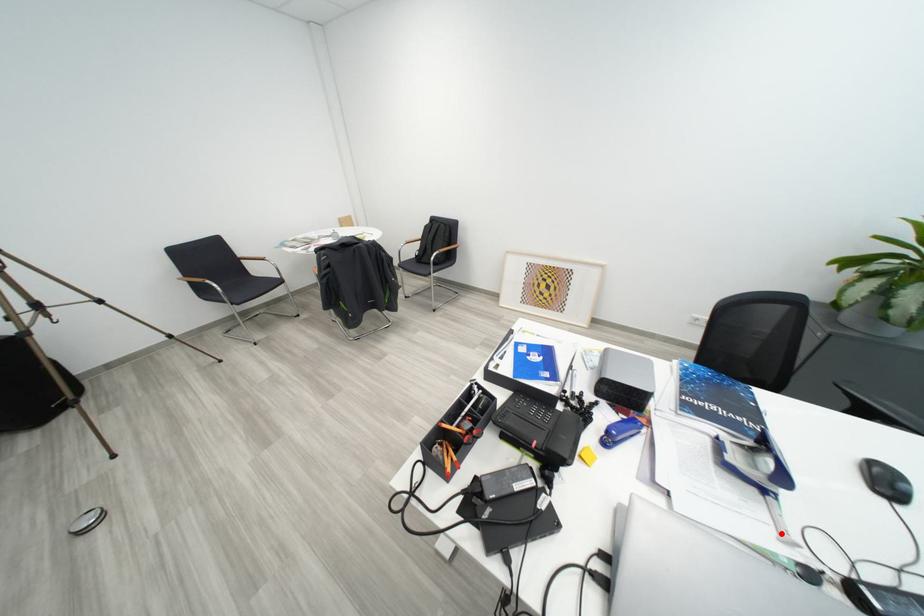
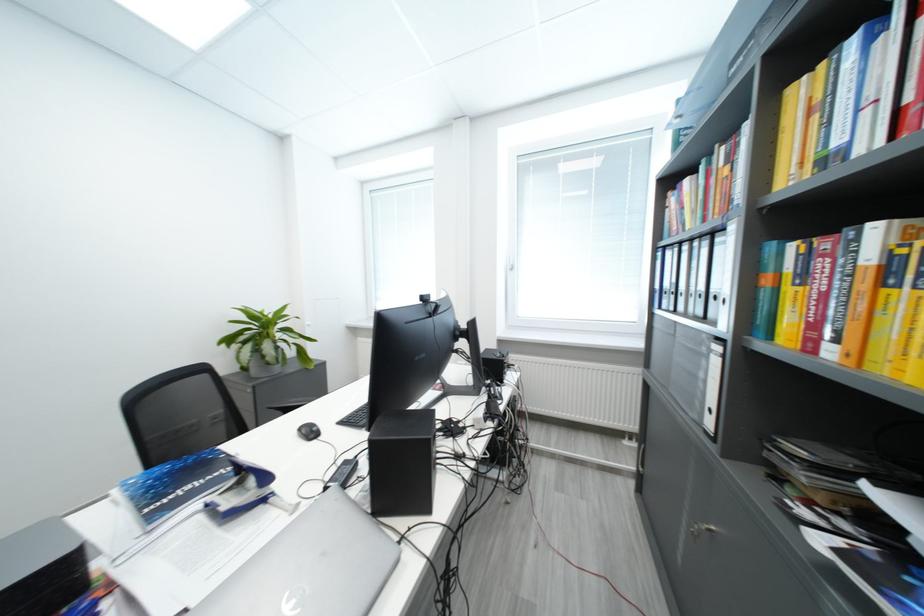
In the second image, find the point that corresponds to the highlighted location in the first image.

(293, 517)